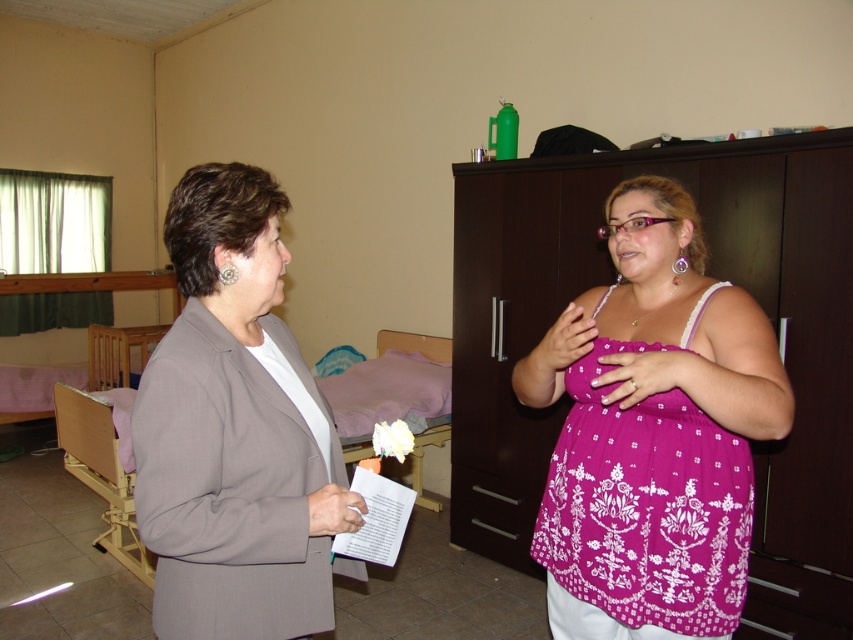
You are a fashion designer observing two clothing items in a room. You see the purple printed blouse at center and the matte gray blazer at center. Which clothing item is positioned lower on the person?

The purple printed blouse at center is located below the matte gray blazer at center, so the purple printed blouse at center is positioned lower on the person.

You are a photographer setting up a shoot in this room. You want to ensure both the purple printed blouse at center and the matte gray blazer at center are clearly visible in the photo. Based on their positions, which clothing item might naturally be more in focus if you focus on the foreground?

The purple printed blouse at center would naturally be more in focus because the matte gray blazer at center is positioned behind it, making the blouse closer to the camera.